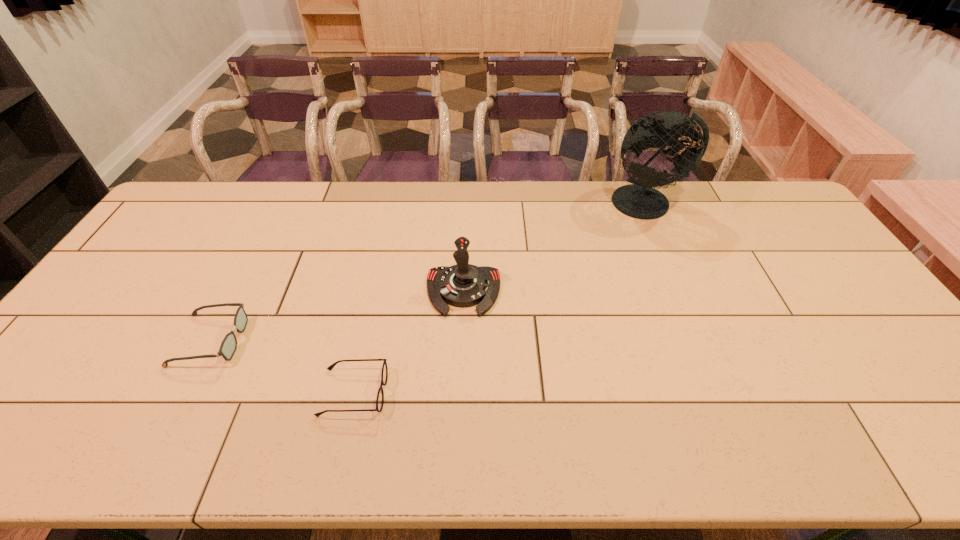
The width and height of the screenshot is (960, 540). Identify the location of free space located 0.360m on the front-facing side of the third object from right to left. (538, 393).

Locate an element on the screen. object located in the far edge section of the desktop is located at coordinates (639, 200).

Locate an element on the screen. vacant space at the far edge of the desktop is located at coordinates (323, 204).

Find the location of `free location at the near edge`. free location at the near edge is located at coordinates (861, 442).

At what (x,y) coordinates should I click in order to perform the action: click on free spot at the left edge of the desktop. Please return your answer as a coordinate pair (x, y). The image size is (960, 540). Looking at the image, I should click on (167, 264).

In the image, there is a desktop. Where is `vacant space at the right edge`? This screenshot has width=960, height=540. vacant space at the right edge is located at coordinates (802, 256).

At what (x,y) coordinates should I click in order to perform the action: click on free space at the far right corner of the desktop. Please return your answer as a coordinate pair (x, y). Image resolution: width=960 pixels, height=540 pixels. Looking at the image, I should click on (786, 217).

Locate an element on the screen. This screenshot has width=960, height=540. empty space that is in between the globe and the left spectacles is located at coordinates (429, 271).

The width and height of the screenshot is (960, 540). I want to click on free space between the rightmost object and the third object from left to right, so click(x=555, y=247).

You are a GUI agent. You are given a task and a screenshot of the screen. Output one action in this format:
    pyautogui.click(x=<x>, y=<y>)
    Task: Click on the free spot between the left spectacles and the third shortest object
    
    Given the screenshot: What is the action you would take?
    pyautogui.click(x=337, y=316)